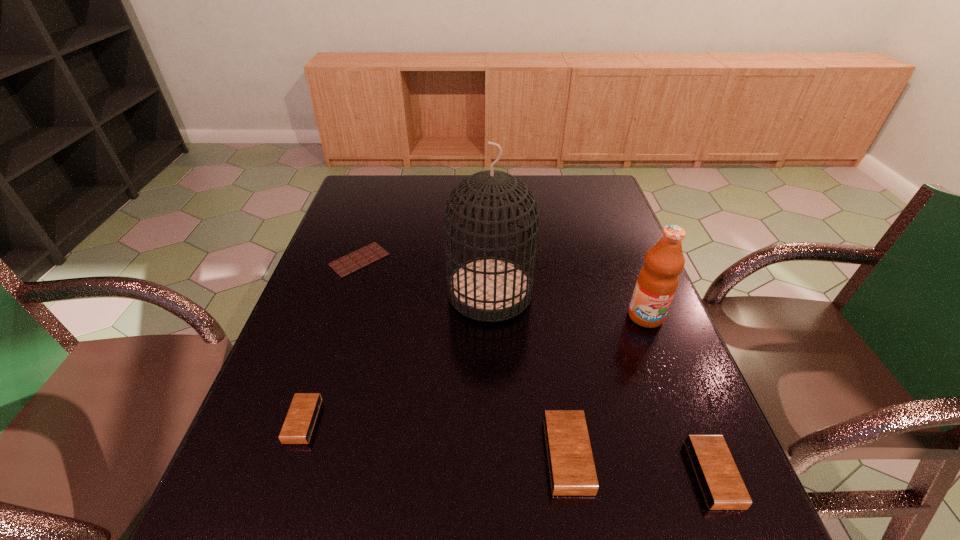
Identify the location of free space for an extra alarm_clock to achieve even spacing. (431, 438).